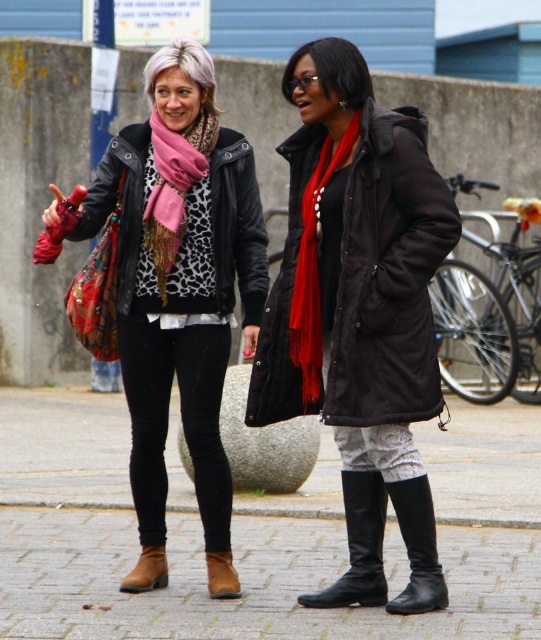
You are a delivery robot with a 12 feet long package. You need to move from the red matte scarf at center to the leather boot at lower left. Can you fit the package between these two points without bending it?

The distance between the red matte scarf at center and the leather boot at lower left is 11.57 feet, which is shorter than the 12 feet long package. Therefore, the package cannot fit straight between these two points.

You are a delivery robot with a 20 feet maximum delivery range. You are positioned at the location of the matte black jacket at center and need to deliver a package to the black leather boot at lower right. Can you complete the delivery within your range?

A: The distance between the matte black jacket at center and the black leather boot at lower right is 23.97 feet, which exceeds the robot